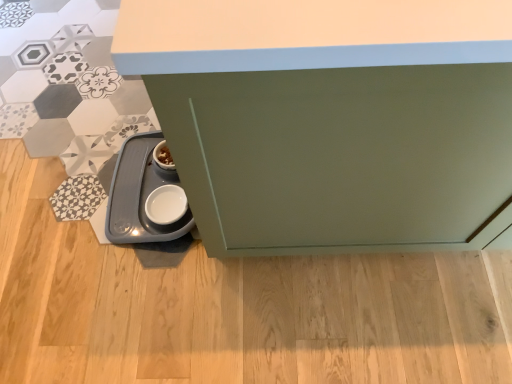
Image resolution: width=512 pixels, height=384 pixels. Describe the element at coordinates (139, 195) in the screenshot. I see `white glossy pet feeder at lower left` at that location.

Find the location of `white glossy pet feeder at lower left`. white glossy pet feeder at lower left is located at coordinates (139, 195).

Find the location of `satin green cabinet at lower left`. satin green cabinet at lower left is located at coordinates (332, 119).

Describe the element at coordinates (332, 119) in the screenshot. I see `satin green cabinet at lower left` at that location.

Where is `white glossy pet feeder at lower left`? white glossy pet feeder at lower left is located at coordinates (139, 195).

Does satin green cabinet at lower left appear on the left side of white glossy pet feeder at lower left?

Incorrect, satin green cabinet at lower left is not on the left side of white glossy pet feeder at lower left.

From the picture: Considering the positions of objects satin green cabinet at lower left and white glossy pet feeder at lower left in the image provided, who is behind, satin green cabinet at lower left or white glossy pet feeder at lower left?

white glossy pet feeder at lower left is behind.

Considering the positions of points (193, 179) and (143, 216), is point (193, 179) closer to camera compared to point (143, 216)?

Yes, it is.

From the image's perspective, which one is positioned higher, satin green cabinet at lower left or white glossy pet feeder at lower left?

satin green cabinet at lower left, from the image's perspective.

From a real-world perspective, does satin green cabinet at lower left sit lower than white glossy pet feeder at lower left?

Incorrect, from a real-world perspective, satin green cabinet at lower left is higher than white glossy pet feeder at lower left.

Can you confirm if satin green cabinet at lower left is thinner than white glossy pet feeder at lower left?

In fact, satin green cabinet at lower left might be wider than white glossy pet feeder at lower left.

Which of these two, satin green cabinet at lower left or white glossy pet feeder at lower left, stands shorter?

Answer: Standing shorter between the two is white glossy pet feeder at lower left.

Between satin green cabinet at lower left and white glossy pet feeder at lower left, which one has larger size?

With larger size is satin green cabinet at lower left.

Which is correct: satin green cabinet at lower left is inside white glossy pet feeder at lower left, or outside of it?

satin green cabinet at lower left is outside white glossy pet feeder at lower left.

Is satin green cabinet at lower left placed right next to white glossy pet feeder at lower left?

There is a gap between satin green cabinet at lower left and white glossy pet feeder at lower left.

Could you tell me if satin green cabinet at lower left is turned towards white glossy pet feeder at lower left?

No, satin green cabinet at lower left is not oriented towards white glossy pet feeder at lower left.

Can you tell me how much satin green cabinet at lower left and white glossy pet feeder at lower left differ in facing direction?

The facing directions of satin green cabinet at lower left and white glossy pet feeder at lower left are 90.3 degrees apart.

How far apart are satin green cabinet at lower left and white glossy pet feeder at lower left?

They are 23.84 inches apart.

Locate an element on the screen. The image size is (512, 384). cabinetry above the white glossy pet feeder at lower left (from a real-world perspective) is located at coordinates [332, 119].

Considering the positions of objects white glossy pet feeder at lower left and satin green cabinet at lower left in the image provided, who is more to the left, white glossy pet feeder at lower left or satin green cabinet at lower left?

From the viewer's perspective, white glossy pet feeder at lower left appears more on the left side.

Which object is further away from the camera taking this photo, white glossy pet feeder at lower left or satin green cabinet at lower left?

white glossy pet feeder at lower left is further from the camera.

Does point (109, 230) appear closer or farther from the camera than point (408, 236)?

Point (109, 230) appears to be farther away from the viewer than point (408, 236).

From the image's perspective, is white glossy pet feeder at lower left under satin green cabinet at lower left?

Yes.

From a real-world perspective, is white glossy pet feeder at lower left on satin green cabinet at lower left?

No, from a real-world perspective, white glossy pet feeder at lower left is not above satin green cabinet at lower left.

Can you confirm if white glossy pet feeder at lower left is wider than satin green cabinet at lower left?

No, white glossy pet feeder at lower left is not wider than satin green cabinet at lower left.

Considering the sizes of objects white glossy pet feeder at lower left and satin green cabinet at lower left in the image provided, who is taller, white glossy pet feeder at lower left or satin green cabinet at lower left?

satin green cabinet at lower left.

Considering the sizes of objects white glossy pet feeder at lower left and satin green cabinet at lower left in the image provided, who is bigger, white glossy pet feeder at lower left or satin green cabinet at lower left?

satin green cabinet at lower left is bigger.

Is white glossy pet feeder at lower left located outside satin green cabinet at lower left?

Absolutely, white glossy pet feeder at lower left is external to satin green cabinet at lower left.

Are white glossy pet feeder at lower left and satin green cabinet at lower left far apart?

That's not correct — white glossy pet feeder at lower left is a little close to satin green cabinet at lower left.

Is white glossy pet feeder at lower left looking in the opposite direction of satin green cabinet at lower left?

Yes, satin green cabinet at lower left is at the back of white glossy pet feeder at lower left.

How much distance is there between white glossy pet feeder at lower left and satin green cabinet at lower left?

white glossy pet feeder at lower left and satin green cabinet at lower left are 60.54 centimeters apart from each other.

Locate an element on the screen. This screenshot has height=384, width=512. cabinetry above the white glossy pet feeder at lower left (from the image's perspective) is located at coordinates (332, 119).

In order to click on cabinetry above the white glossy pet feeder at lower left (from a real-world perspective) in this screenshot , I will do tap(332, 119).

Identify the location of cabinetry on the right of white glossy pet feeder at lower left. This screenshot has width=512, height=384. (332, 119).